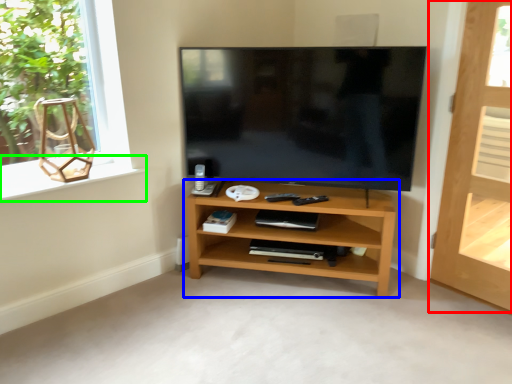
Question: Which object is the closest to the door (highlighted by a red box)? Choose among these: shelf (highlighted by a blue box) or window sill (highlighted by a green box).

Choices:
 (A) shelf
 (B) window sill

Answer: (A)